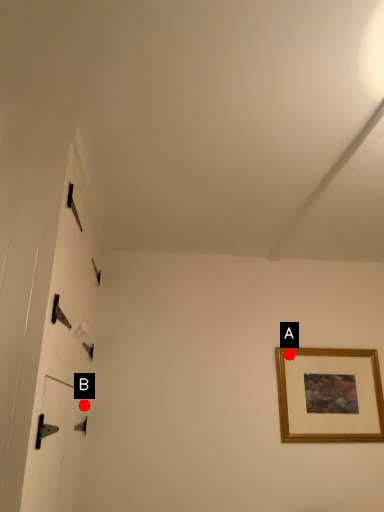
Question: Two points are circled on the image, labeled by A and B beside each circle. Which point is closer to the camera?

Choices:
 (A) A is closer
 (B) B is closer

Answer: (B)